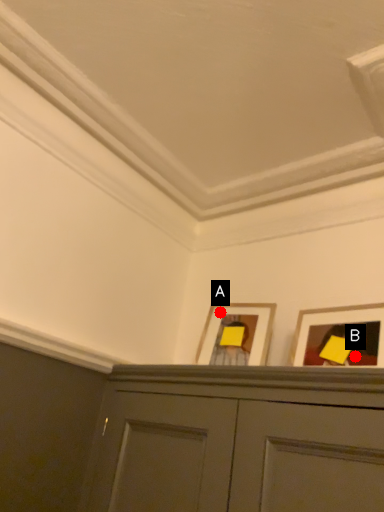
Question: Two points are circled on the image, labeled by A and B beside each circle. Which point appears farthest from the camera in this image?

Choices:
 (A) A is further
 (B) B is further

Answer: (A)